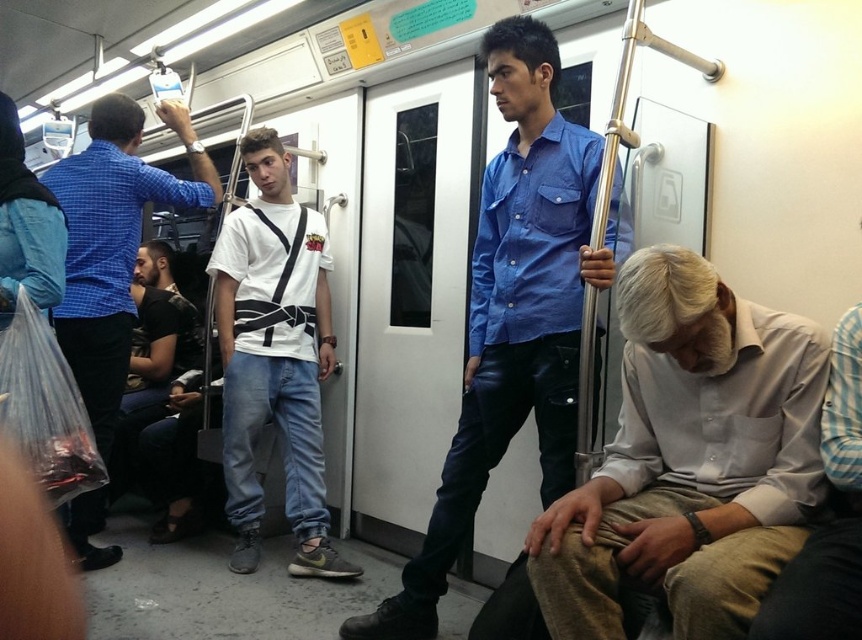
Question: Where is blue cotton shirt at center located in relation to white matte t-shirt at center in the image?

Choices:
 (A) below
 (B) above

Answer: (B)

Question: Can you confirm if blue cotton shirt at center is bigger than brushed metal shirt at left?

Choices:
 (A) yes
 (B) no

Answer: (A)

Question: Can you confirm if gray cotton shirt at lower right is wider than blue cotton shirt at center?

Choices:
 (A) no
 (B) yes

Answer: (A)

Question: Which point appears closest to the camera in this image?

Choices:
 (A) (486, 394)
 (B) (295, 400)

Answer: (A)

Question: Among these objects, which one is farthest from the camera?

Choices:
 (A) blue cotton shirt at center
 (B) white matte t-shirt at center
 (C) gray cotton shirt at lower right
 (D) brushed metal shirt at left

Answer: (B)

Question: Among these objects, which one is nearest to the camera?

Choices:
 (A) brushed metal shirt at left
 (B) white matte t-shirt at center

Answer: (A)